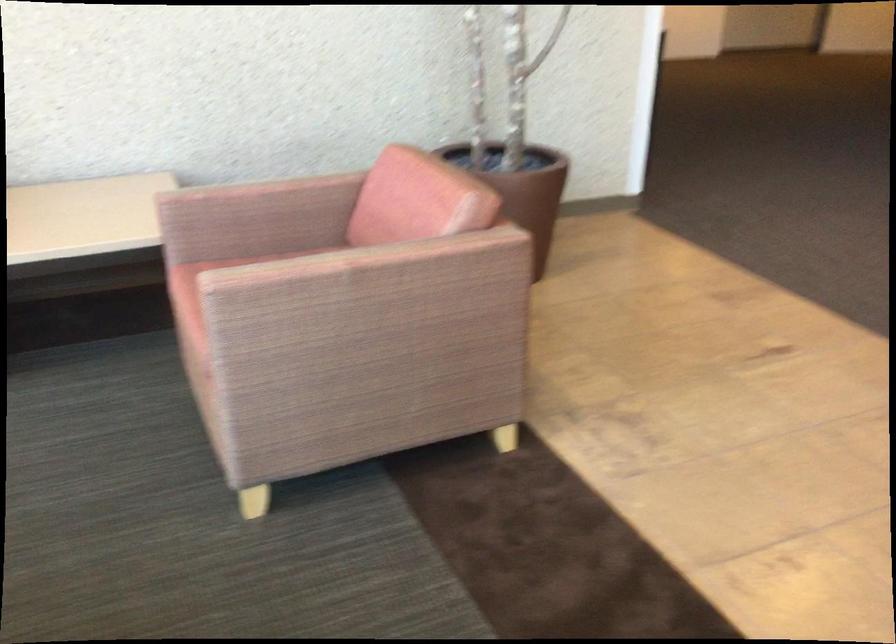
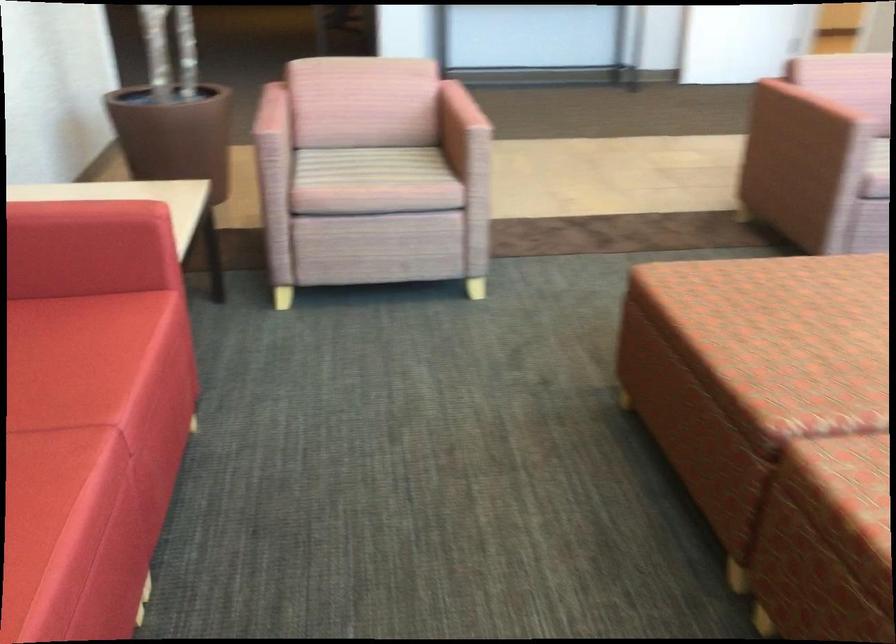
Locate, in the second image, the point that corresponds to point (237, 185) in the first image.

(271, 113)